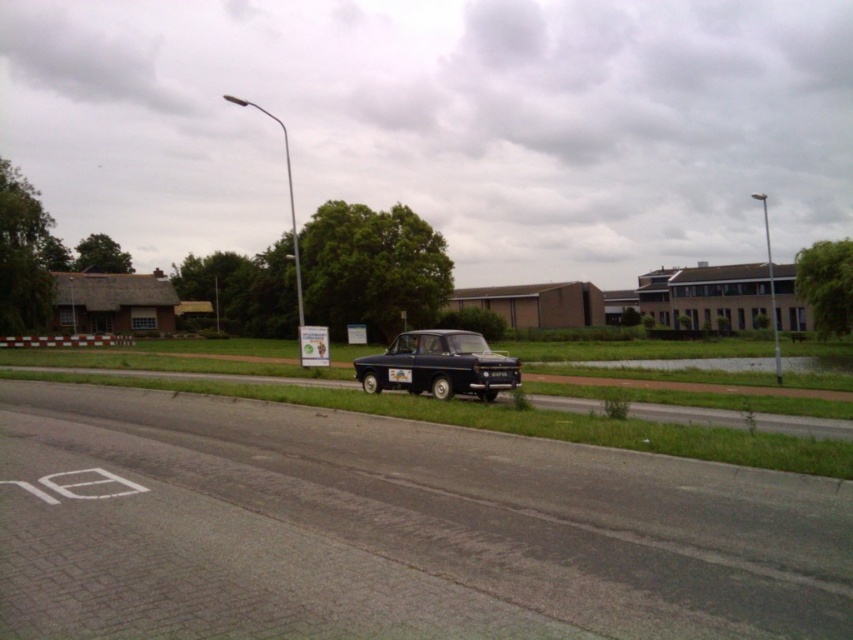
Looking at this image, does shiny blue car at center appear under metallic silver car at upper center?

Indeed, shiny blue car at center is positioned under metallic silver car at upper center.

Is shiny blue car at center taller than metallic silver car at upper center?

Incorrect, shiny blue car at center's height is not larger of metallic silver car at upper center's.

Between point (492, 376) and point (283, 148), which one is positioned in front?

Point (492, 376) is more forward.

This screenshot has height=640, width=853. Find the location of `shiny blue car at center`. shiny blue car at center is located at coordinates (438, 365).